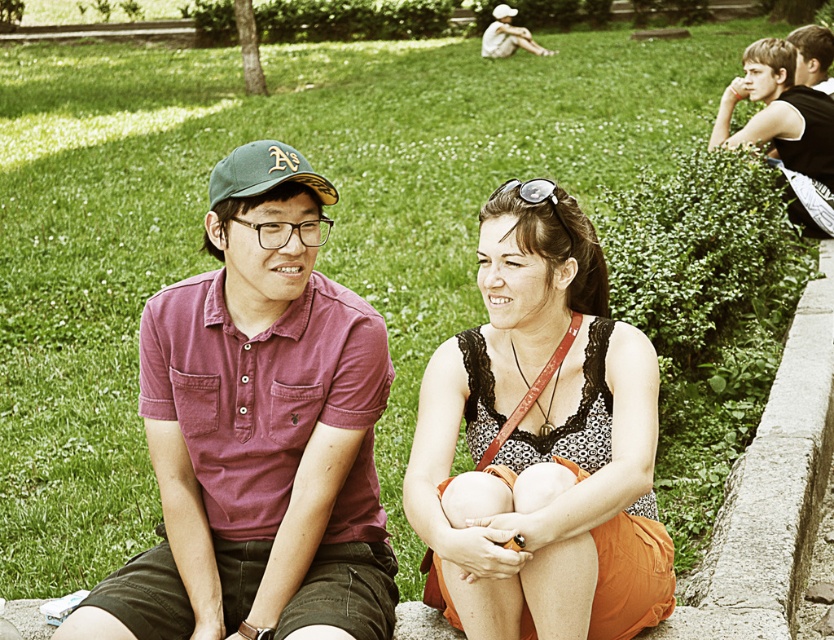
You are planning to take a photo of the orange lace dress at center and the smooth black shirt at upper right. The camera you are using has a maximum focus range of 15 feet. Will both subjects be in focus?

The orange lace dress at center is 15.52 feet from the smooth black shirt at upper right. Since the distance between them is slightly over the camera maximum focus range of 15 feet, the camera might not be able to focus on both subjects simultaneously.

You are a photographer trying to capture the perfect shot of the matte cotton polo shirt at center. Given that the camera you are using has a focal length of 50mm and the subject is 3 meters away, what is the approximate size of the shirt in millimeters on the camera sensor?

The position of matte cotton polo shirt at center is at point (259, 432), so the answer can be calculated using the formula size on sensor equals object size multiplied by focal length divided by distance. However, without knowing the actual size of the polo shirt, we cannot compute the exact sensor size.

You are standing in the park and see two points in the image. The first point is at coordinates point (561,259) and the second is at point (802,211). Which point is closer to you?

Point (561,259) is closer to the viewer than point (802,211).